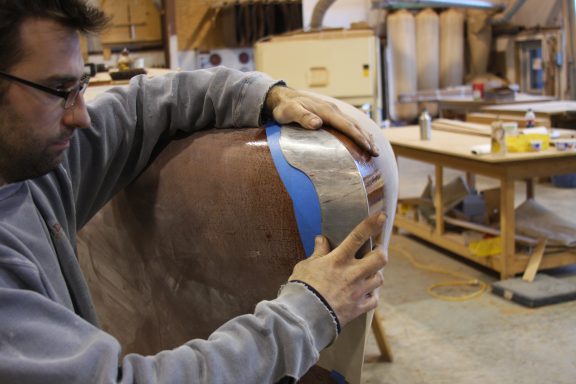
Locate an element on the screen. table is located at coordinates (448, 145).